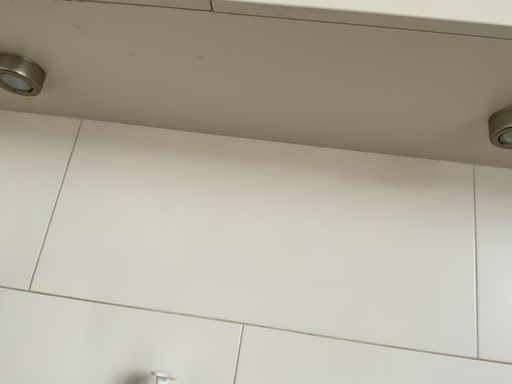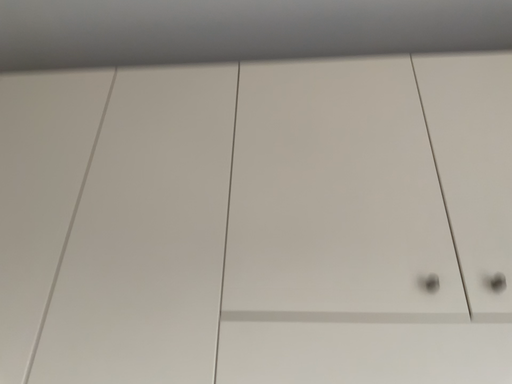
Question: Which way did the camera rotate in the video?

Choices:
 (A) rotated downward
 (B) rotated upward

Answer: (B)